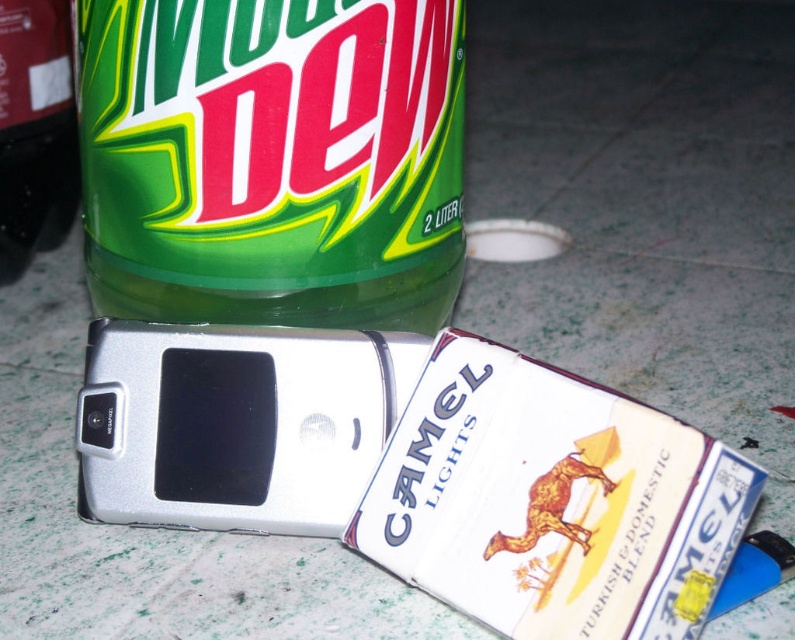
Which is above, silver metallic phone at center or green matte bottle at upper left?

green matte bottle at upper left is higher up.

Does silver metallic phone at center have a larger size compared to green matte bottle at upper left?

Incorrect, silver metallic phone at center is not larger than green matte bottle at upper left.

Is point (363, 403) less distant than point (53, 81)?

Yes, it is in front of point (53, 81).

Identify the location of silver metallic phone at center. This screenshot has height=640, width=795. (235, 422).

Does point (369, 24) come closer to viewer compared to point (49, 88)?

Yes, it is.

How distant is green matte plastic bottle at upper left from green matte bottle at upper left?

18.52 inches

Find the location of `green matte plastic bottle at upper left`. green matte plastic bottle at upper left is located at coordinates (272, 160).

Which is behind, point (115, 269) or point (173, 420)?

The point (115, 269) is more distant.

Is point (293, 284) more distant than point (334, 392)?

Yes, it is.

Locate an element on the screen. This screenshot has height=640, width=795. green matte plastic bottle at upper left is located at coordinates (272, 160).